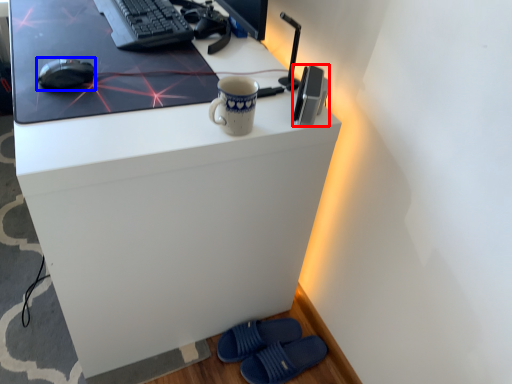
Question: Among these objects, which one is nearest to the camera, gadget (highlighted by a red box) or mouse (highlighted by a blue box)?

Choices:
 (A) gadget
 (B) mouse

Answer: (A)